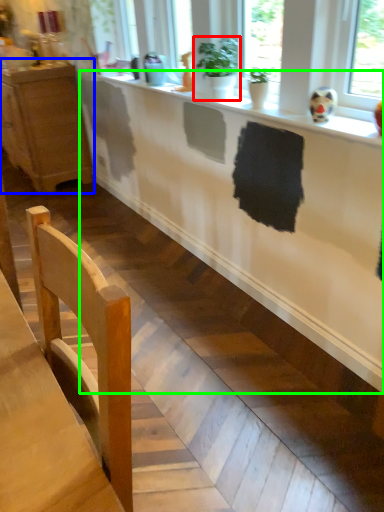
Question: Which object is the farthest from houseplant (highlighted by a red box)? Choose among these: cabinetry (highlighted by a blue box) or counter (highlighted by a green box).

Choices:
 (A) cabinetry
 (B) counter

Answer: (A)